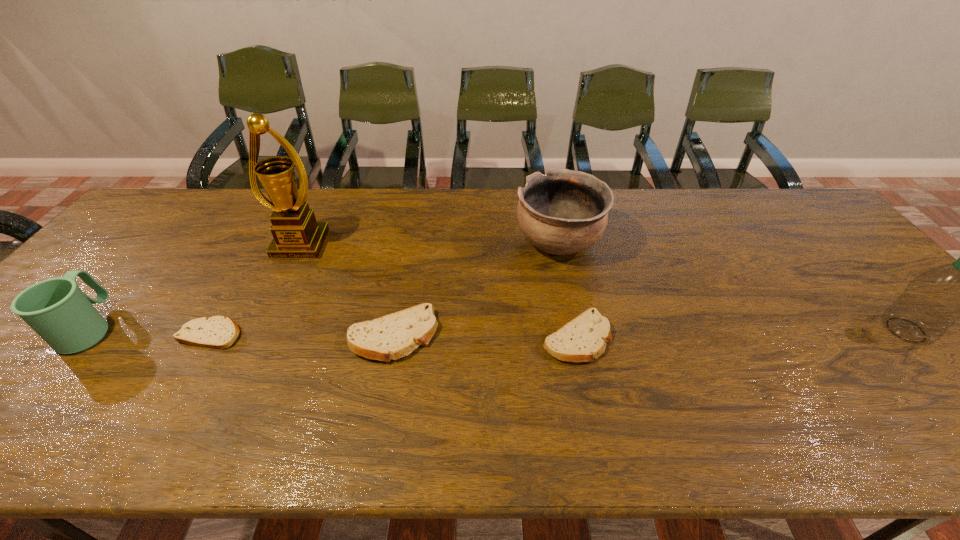
This screenshot has width=960, height=540. I want to click on vacant area located 0.350m on the left of the rightmost object, so click(740, 330).

Where is `object at the far edge`? The width and height of the screenshot is (960, 540). object at the far edge is located at coordinates (563, 212).

At what (x,y) coordinates should I click in order to perform the action: click on object present at the left edge. Please return your answer as a coordinate pair (x, y). Image resolution: width=960 pixels, height=540 pixels. Looking at the image, I should click on (57, 309).

Image resolution: width=960 pixels, height=540 pixels. Find the location of `object that is positioned at the right edge`. object that is positioned at the right edge is located at coordinates (932, 302).

The width and height of the screenshot is (960, 540). In the image, there is a desktop. What are the coordinates of `free region at the far edge` in the screenshot? It's located at (465, 190).

Locate an element on the screen. vacant space at the near edge is located at coordinates (293, 388).

Find the location of a particular element. vacant space at the right edge of the desktop is located at coordinates (820, 273).

Where is `vacant space that is in between the rightmost pita bread and the fourth object from right to left`? vacant space that is in between the rightmost pita bread and the fourth object from right to left is located at coordinates (485, 337).

The height and width of the screenshot is (540, 960). Identify the location of free spot between the second tallest pita bread and the fifth tallest object. (485, 337).

At what (x,y) coordinates should I click in order to perform the action: click on free space between the shortest pita bread and the fifth shortest object. Please return your answer as a coordinate pair (x, y). The height and width of the screenshot is (540, 960). Looking at the image, I should click on (384, 288).